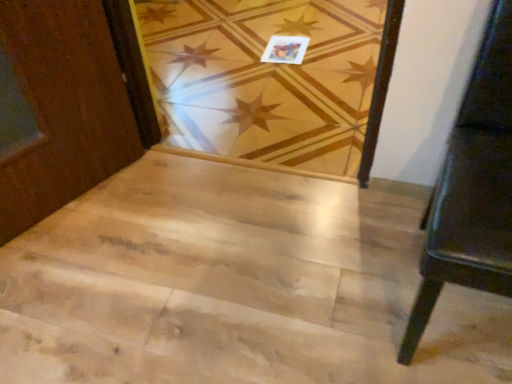
The height and width of the screenshot is (384, 512). What are the coordinates of `vacant region under black leather bench at right (from a real-world perspective)` in the screenshot? It's located at (450, 312).